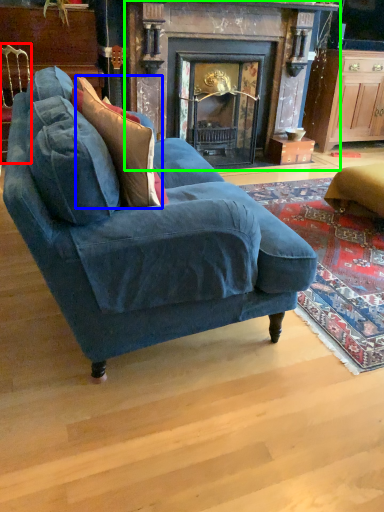
Question: Estimate the real-world distances between objects in this image. Which object is farther from chair (highlighted by a red box), throw pillow (highlighted by a blue box) or fireplace (highlighted by a green box)?

Choices:
 (A) throw pillow
 (B) fireplace

Answer: (B)